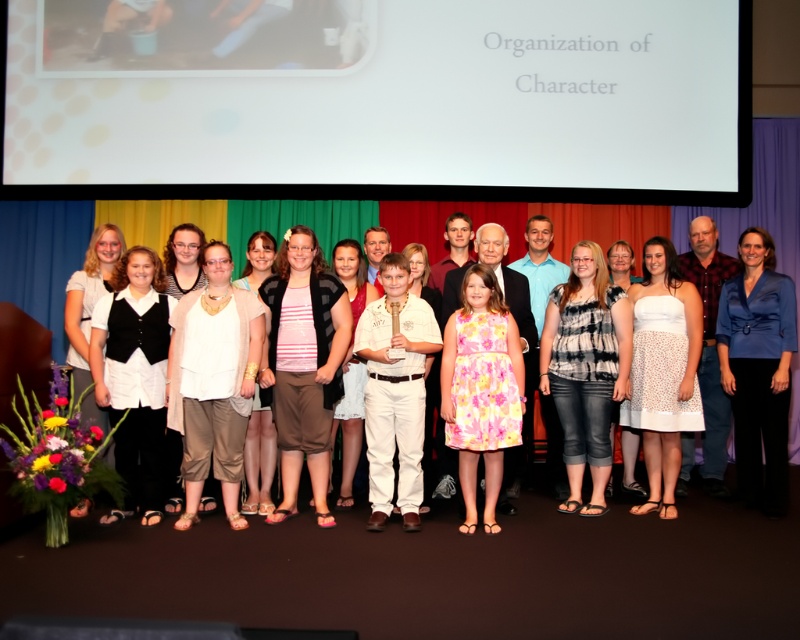
You are a photographer trying to adjust the lighting for a group photo. The scene has a white textured blouse at center and a blue plaid shirt at right. Which object should you focus on first if you want to ensure both are properly lit, considering their size?

The blue plaid shirt at right is larger in size compared to the white textured blouse at center. Therefore, you should focus on lighting the blue plaid shirt at right first to ensure proper exposure, then adjust for the smaller white textured blouse at center.

From the picture: You are a photographer at the event and need to ensure all participants are visible in the photo. You notice two white dresses at the left side of the group. Which dress should you ask the participant in to lower their hem slightly to ensure visibility? The dresses are the white textured dress at left and the white matte dress at left.

The white textured dress at left is shorter than the white matte dress at left, so you should ask the participant in the white textured dress at left to lower their hem to ensure visibility.